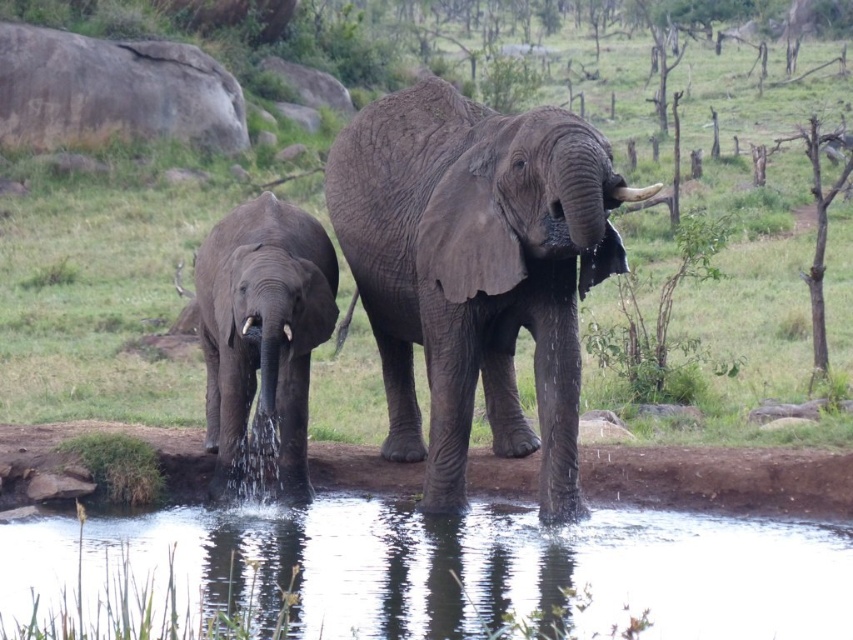
Looking at this image, does transparent liquid water at center have a lesser width compared to gray textured elephant at left?

No, transparent liquid water at center is not thinner than gray textured elephant at left.

Who is positioned more to the right, transparent liquid water at center or gray textured elephant at left?

Positioned to the right is transparent liquid water at center.

Find the location of a particular element. transparent liquid water at center is located at coordinates (496, 566).

Can you confirm if gray textured elephant at center is bigger than white ivory tusk at upper center?

Incorrect, gray textured elephant at center is not larger than white ivory tusk at upper center.

Is gray textured elephant at center closer to camera compared to white ivory tusk at upper center?

No.

Which is behind, point (502, 184) or point (633, 202)?

Point (502, 184)

At what (x,y) coordinates should I click in order to perform the action: click on gray textured elephant at center. Please return your answer as a coordinate pair (x, y). The height and width of the screenshot is (640, 853). Looking at the image, I should click on (474, 272).

Is transparent liquid water at center thinner than white ivory tusk at upper center?

In fact, transparent liquid water at center might be wider than white ivory tusk at upper center.

Who is more forward, [590,580] or [627,196]?

Point [627,196] is in front.

Is point (485, 525) positioned behind point (640, 200)?

Yes, point (485, 525) is farther from viewer.

This screenshot has width=853, height=640. I want to click on transparent liquid water at center, so click(x=496, y=566).